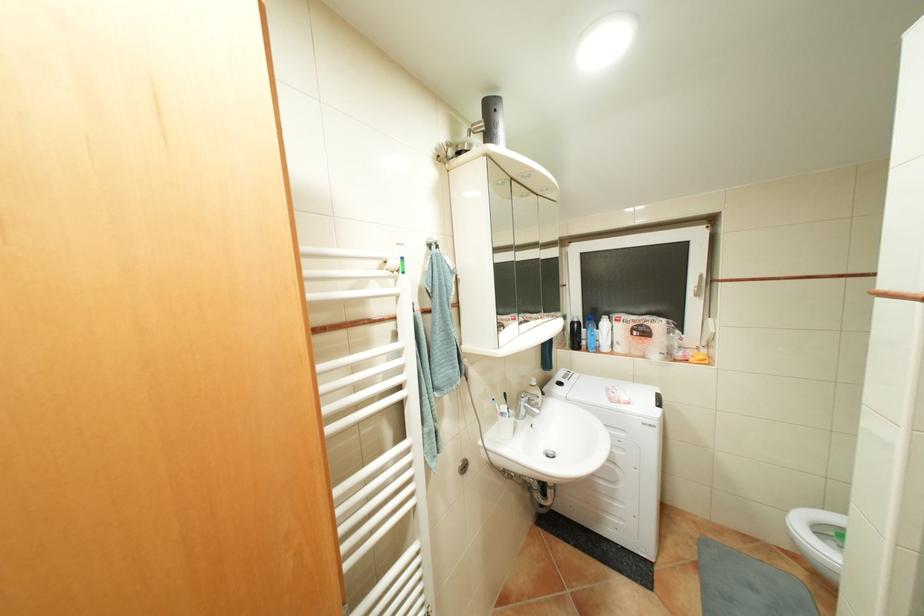
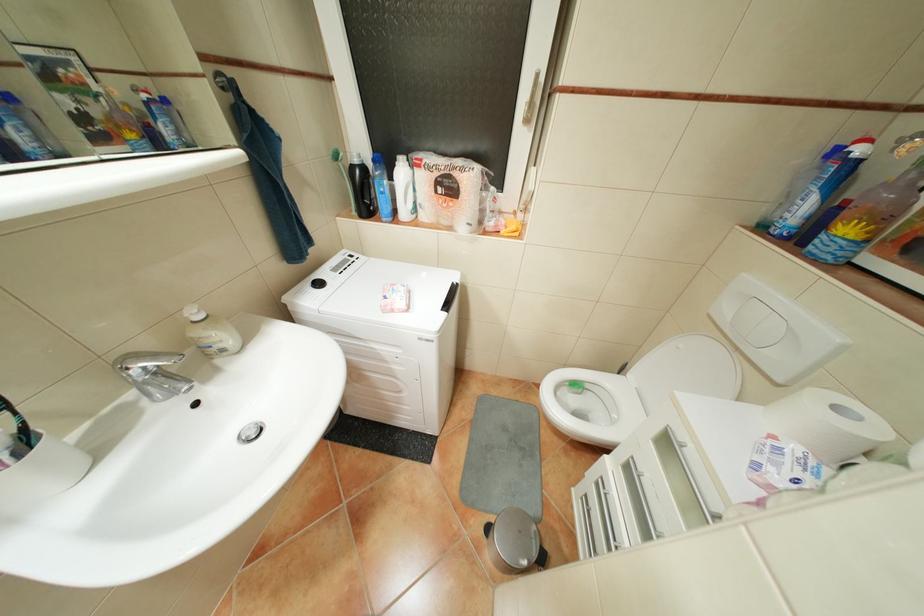
Where in the second image is the point corresponding to point 589,322 from the first image?

(373, 167)